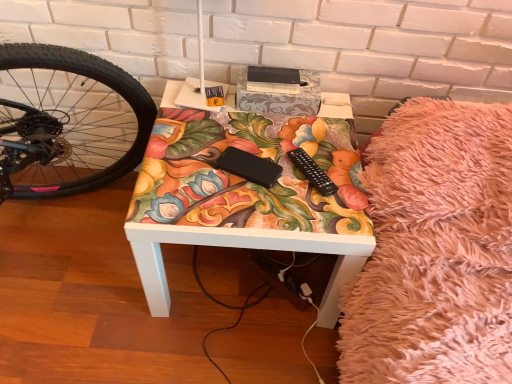
What do you see at coordinates (246, 248) in the screenshot? I see `painted wood table at center` at bounding box center [246, 248].

The height and width of the screenshot is (384, 512). I want to click on painted wood table at center, so click(246, 248).

Where is `painted wood table at center`? painted wood table at center is located at coordinates (246, 248).